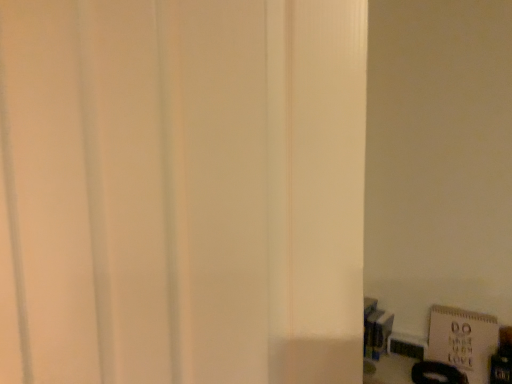
Question: Can you confirm if white matte door at center is bigger than white matte bulletin board at lower right?

Choices:
 (A) no
 (B) yes

Answer: (B)

Question: Is white matte door at center to the left of white matte bulletin board at lower right from the viewer's perspective?

Choices:
 (A) no
 (B) yes

Answer: (B)

Question: Does white matte door at center have a lesser width compared to white matte bulletin board at lower right?

Choices:
 (A) no
 (B) yes

Answer: (A)

Question: Does white matte door at center have a smaller size compared to white matte bulletin board at lower right?

Choices:
 (A) yes
 (B) no

Answer: (B)

Question: Can you confirm if white matte door at center is wider than white matte bulletin board at lower right?

Choices:
 (A) no
 (B) yes

Answer: (B)

Question: Is white matte door at center positioned behind white matte bulletin board at lower right?

Choices:
 (A) yes
 (B) no

Answer: (B)

Question: Is white matte bulletin board at lower right with white matte door at center?

Choices:
 (A) no
 (B) yes

Answer: (A)

Question: Can you confirm if white matte bulletin board at lower right is positioned to the left of white matte door at center?

Choices:
 (A) yes
 (B) no

Answer: (B)

Question: Does white matte bulletin board at lower right appear on the right side of white matte door at center?

Choices:
 (A) no
 (B) yes

Answer: (B)

Question: Can you confirm if white matte bulletin board at lower right is wider than white matte door at center?

Choices:
 (A) yes
 (B) no

Answer: (B)

Question: From a real-world perspective, is white matte bulletin board at lower right located beneath white matte door at center?

Choices:
 (A) no
 (B) yes

Answer: (B)

Question: Can you confirm if white matte bulletin board at lower right is shorter than white matte door at center?

Choices:
 (A) no
 (B) yes

Answer: (B)

Question: Is white matte door at center taller or shorter than white matte bulletin board at lower right?

Choices:
 (A) short
 (B) tall

Answer: (B)